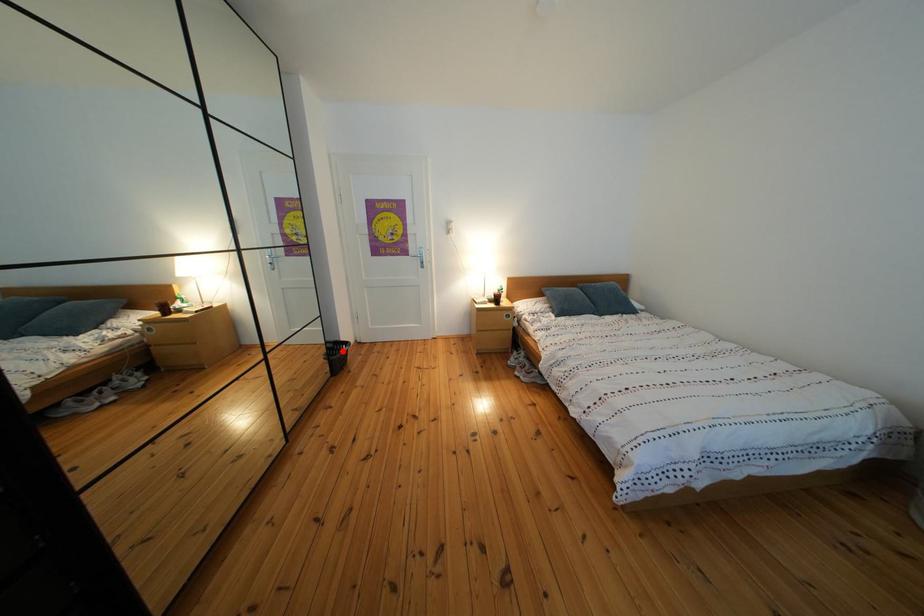
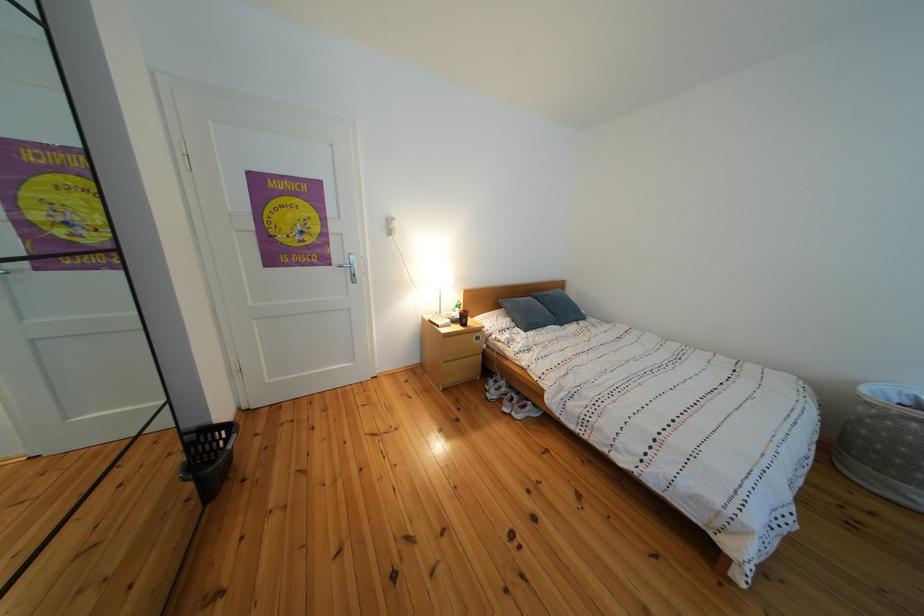
Question: I am providing you with two images of the same scene from different viewpoints. Image1 has a red point marked. In image2, the corresponding 3D location appears at what relative position? Reply with the corresponding letter.

Choices:
 (A) Closer
 (B) Farther

Answer: (B)